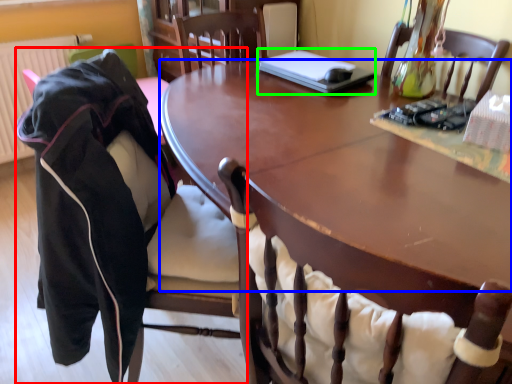
Question: Estimate the real-world distances between objects in this image. Which object is farther from chair (highlighted by a red box), table top (highlighted by a blue box) or laptop (highlighted by a green box)?

Choices:
 (A) table top
 (B) laptop

Answer: (B)